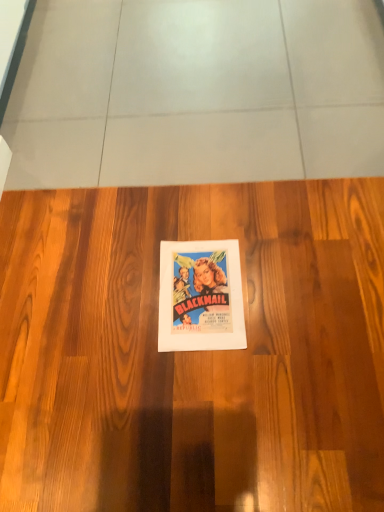
This screenshot has width=384, height=512. I want to click on free space in front of vibrant paper poster at center, so click(x=217, y=385).